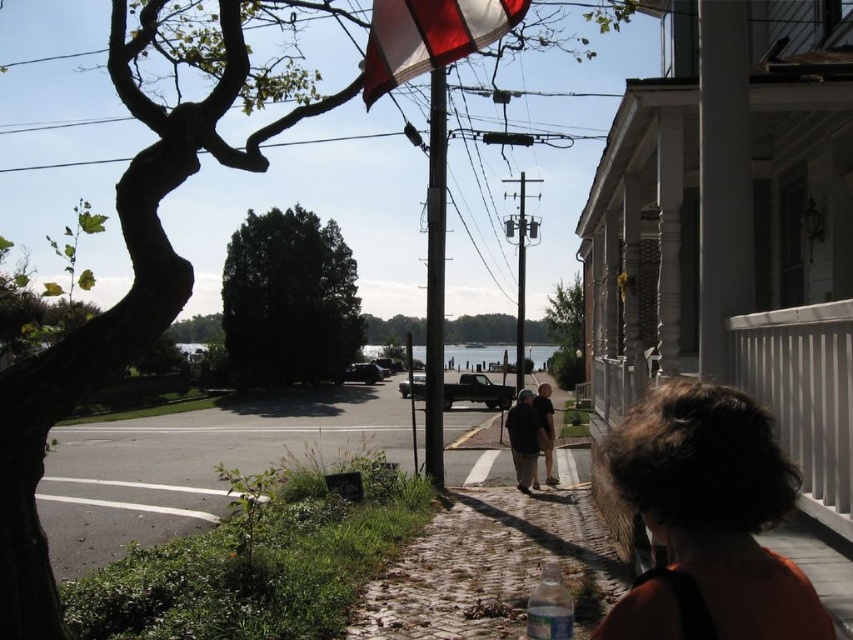
You are a delivery person trying to deliver a package to the house. You see the red fabric flag at upper center and the dark brown leather shoes at center. Which object is higher up in the image?

The red fabric flag at upper center is much taller than the dark brown leather shoes at center, so the red fabric flag at upper center is higher up in the image.

You are standing on the cobblestone path in the suburban street scene. You want to locate the dark brown hair at lower right. According to the coordinates provided, where should you look relative to the tree on the left?

The dark brown hair at lower right is located at coordinates point [717,504], which is to the right side of the tree on the left.